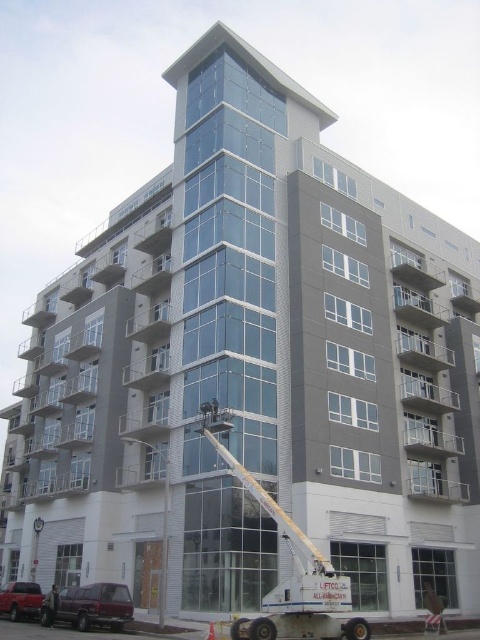
You are a delivery driver approaching the construction site in a vehicle that is 8 feet wide. You need to pass between the maroon metallic van at lower left and the metallic red van at lower left. Can your vehicle fit through the space between them?

The maroon metallic van at lower left and the metallic red van at lower left are 21.29 feet apart from each other. Since your vehicle is 8 feet wide, there is sufficient space for it to pass through the gap between them.

You are standing in front of the construction site and want to determine the relative positions of two points marked on the building facade. Which of the two points, point (88, 611) or point (55, 598), is closer to your viewpoint?

Point (88, 611) is closer to the camera than point (55, 598), so it is the closer one.